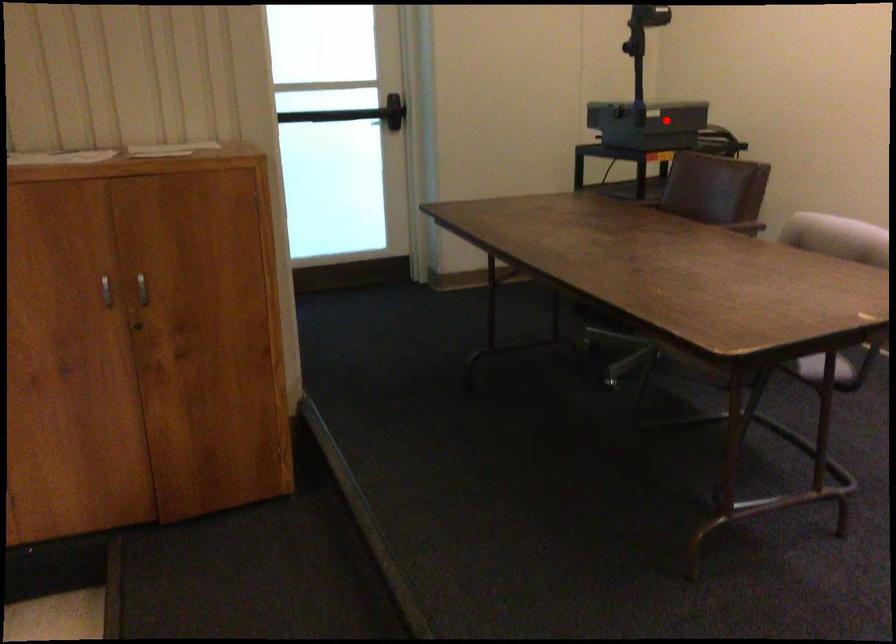
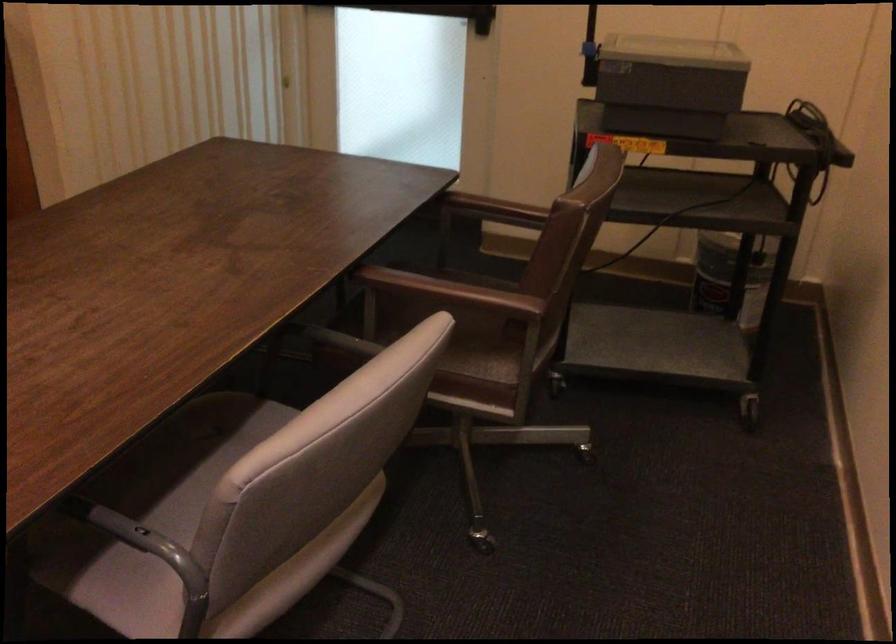
Question: I am providing you with two images of the same scene from different viewpoints. Given a red point in image1, look at the same physical point in image2. Is it:

Choices:
 (A) Closer to the viewpoint
 (B) Farther from the viewpoint

Answer: (A)